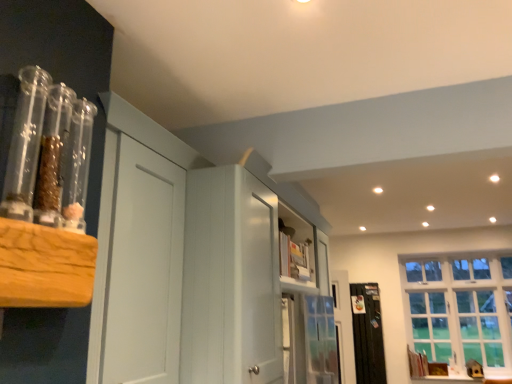
Question: Should I look upward or downward to see black matte radiator at right?

Choices:
 (A) down
 (B) up

Answer: (A)

Question: Is white painted wood cabinet at center bigger than white glass window at right?

Choices:
 (A) yes
 (B) no

Answer: (A)

Question: Are white painted wood cabinet at center and white glass window at right making contact?

Choices:
 (A) yes
 (B) no

Answer: (B)

Question: Is white painted wood cabinet at center shorter than white glass window at right?

Choices:
 (A) yes
 (B) no

Answer: (A)

Question: From the image's perspective, is white painted wood cabinet at center under white glass window at right?

Choices:
 (A) no
 (B) yes

Answer: (A)

Question: Would you say white glass window at right is part of white painted wood cabinet at center's contents?

Choices:
 (A) no
 (B) yes

Answer: (A)

Question: Is white painted wood cabinet at center positioned before white glass window at right?

Choices:
 (A) no
 (B) yes

Answer: (B)

Question: Considering the relative sizes of white glass window at right and white painted wood cabinet at center in the image provided, is white glass window at right bigger than white painted wood cabinet at center?

Choices:
 (A) yes
 (B) no

Answer: (B)

Question: Is white painted wood cabinet at center a part of white glass window at right?

Choices:
 (A) no
 (B) yes

Answer: (A)

Question: Is white glass window at right further to the viewer compared to white painted wood cabinet at center?

Choices:
 (A) yes
 (B) no

Answer: (A)

Question: From the image's perspective, is white glass window at right located beneath white painted wood cabinet at center?

Choices:
 (A) no
 (B) yes

Answer: (B)

Question: Is white glass window at right closer to camera compared to white painted wood cabinet at center?

Choices:
 (A) yes
 (B) no

Answer: (B)

Question: Is white glass window at right to the right of white painted wood cabinet at center from the viewer's perspective?

Choices:
 (A) no
 (B) yes

Answer: (B)

Question: Is white painted wood cabinet at center inside black matte radiator at right?

Choices:
 (A) yes
 (B) no

Answer: (B)